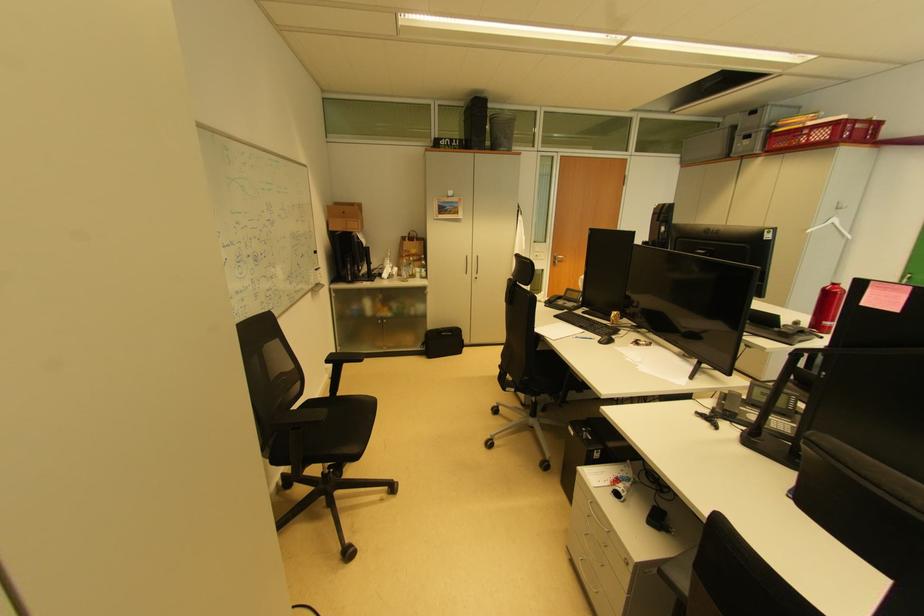
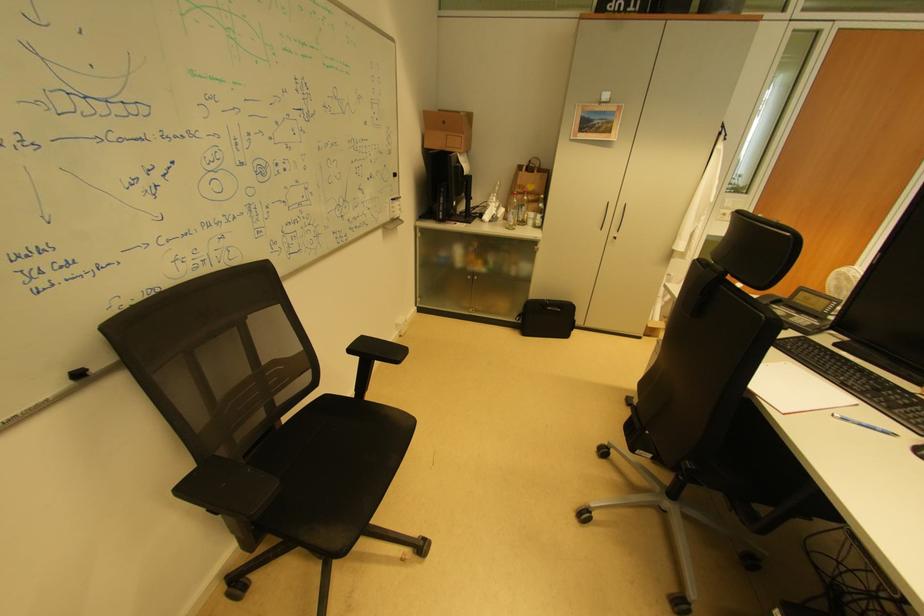
Where in the second image is the point corresponding to pixel 405 270 from the first image?

(512, 211)